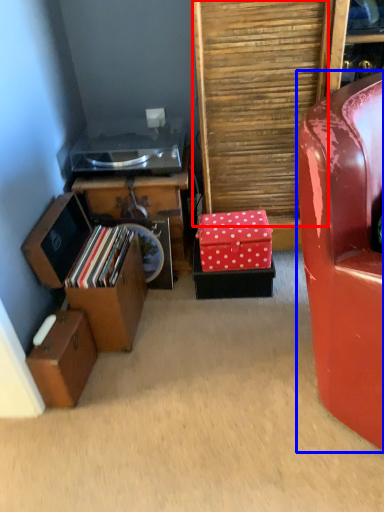
Question: Which object appears farthest to the camera in this image, plywood (highlighted by a red box) or chair (highlighted by a blue box)?

Choices:
 (A) plywood
 (B) chair

Answer: (A)